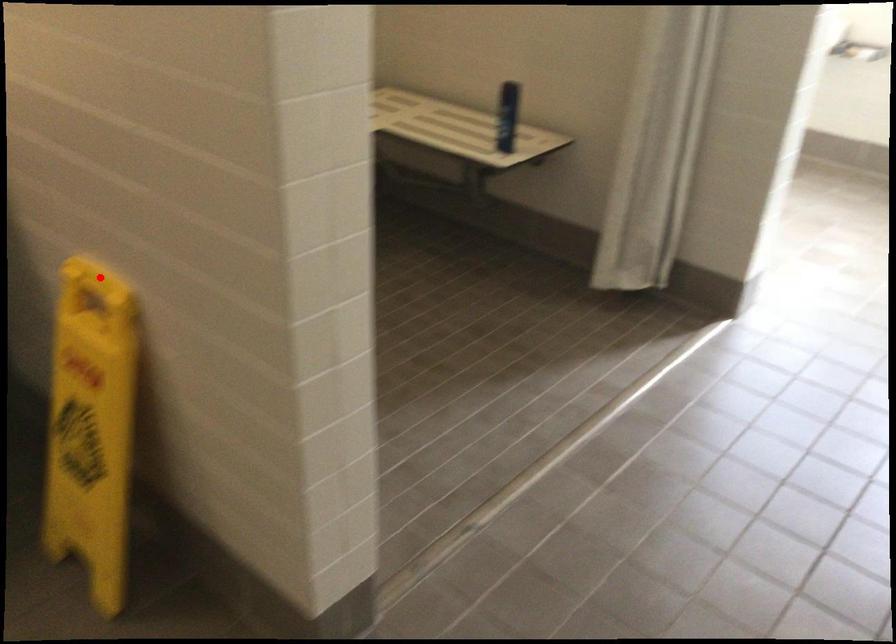
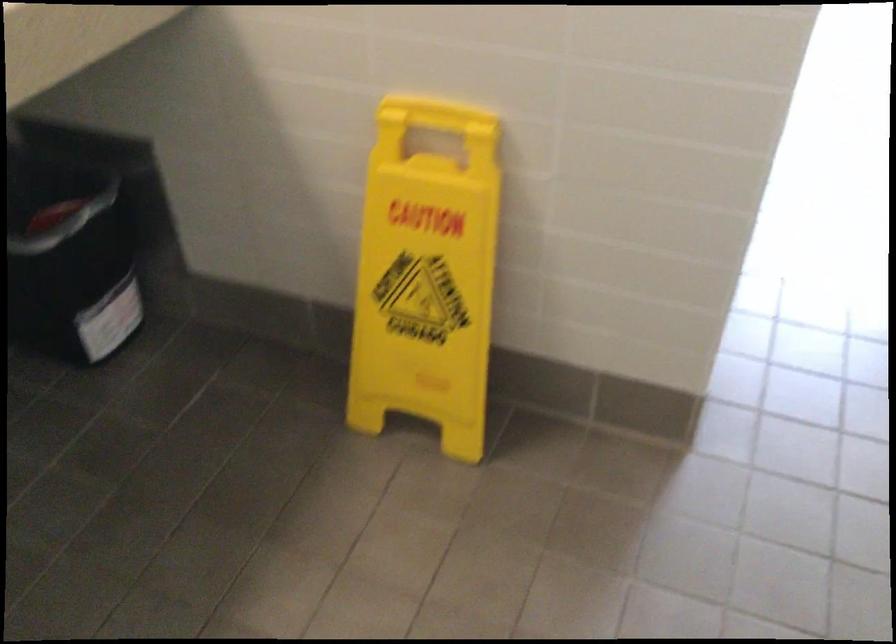
The point at the highlighted location is marked in the first image. Where is the corresponding point in the second image?

(429, 114)